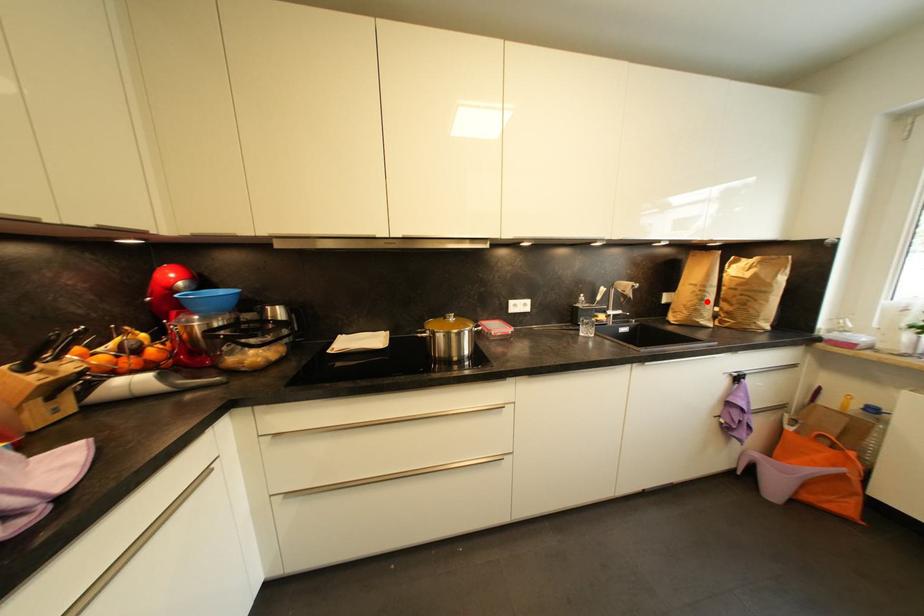
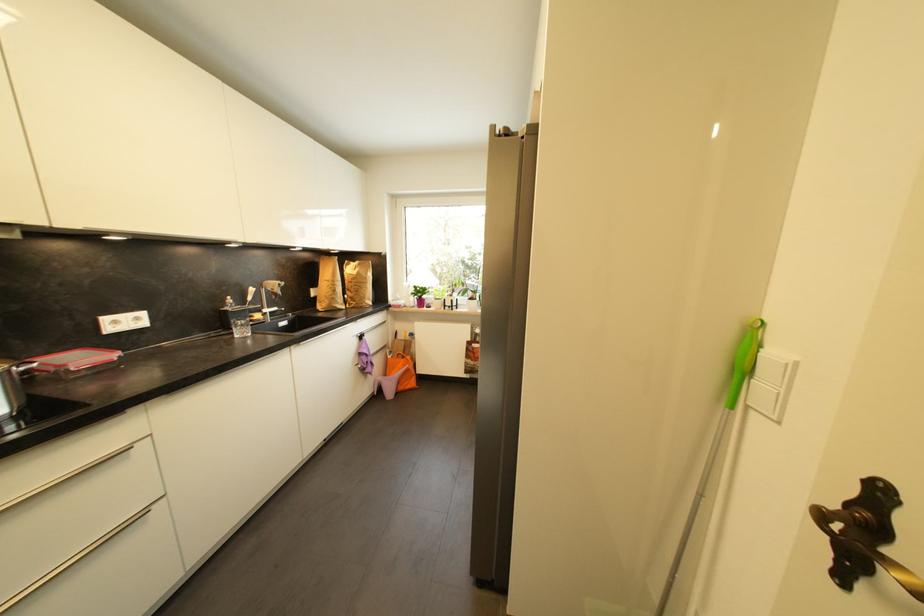
Where in the second image is the point corresponding to the highlighted location from the first image?

(339, 293)